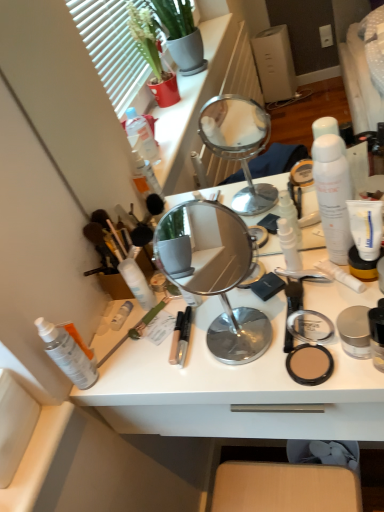
Image resolution: width=384 pixels, height=512 pixels. In order to click on vacant location behind matte beige compact at right in this screenshot , I will do `click(258, 309)`.